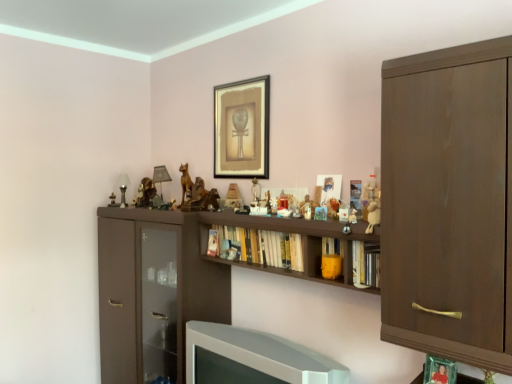
This screenshot has width=512, height=384. What do you see at coordinates (350, 220) in the screenshot?
I see `wooden figurine at center, the 2th toy positioned from the right` at bounding box center [350, 220].

What is the approximate width of hardcover book at center, which ranks as the 3th book in left-to-right order?

hardcover book at center, which ranks as the 3th book in left-to-right order, is 4.78 inches in width.

In order to face white plush sheep at center-right, acting as the first toy starting from the right, should I rotate leftwards or rightwards?

To face it directly, rotate right by 15.589 degrees.

Measure the distance between point [371,218] and camera.

They are 5.12 feet apart.

What are the coordinates of `bronze statue at center` in the screenshot? It's located at (185, 180).

What do you see at coordinates (448, 202) in the screenshot? I see `dark brown wood cabinet at right` at bounding box center [448, 202].

This screenshot has width=512, height=384. What are the coordinates of `wooden figurine at center, placed as the 3th toy when sorted from back to front` in the screenshot? It's located at (350, 220).

Can you confirm if matte wooden figurine at center, the 2th toy positioned from the left, is thinner than yellow matte bookshelf at center, acting as the second book starting from the front?

Yes.

How different are the orientations of matte wooden figurine at center, marked as the 2th toy in a back-to-front arrangement, and yellow matte bookshelf at center, marked as the 2th book in a back-to-front arrangement, in degrees?

The facing directions of matte wooden figurine at center, marked as the 2th toy in a back-to-front arrangement, and yellow matte bookshelf at center, marked as the 2th book in a back-to-front arrangement, are 1.01 degrees apart.

Is matte wooden figurine at center, which ranks as the third toy in right-to-left order, inside the boundaries of yellow matte bookshelf at center, which is counted as the 2th book, starting from the left, or outside?

matte wooden figurine at center, which ranks as the third toy in right-to-left order, is located beyond the bounds of yellow matte bookshelf at center, which is counted as the 2th book, starting from the left.

Which is behind, point (309, 209) or point (322, 259)?

The point (309, 209) is farther.

Is white glossy television at lower center oriented towards wooden figurine at center, the 2th toy positioned from the right?

No, white glossy television at lower center is not facing towards wooden figurine at center, the 2th toy positioned from the right.

Do you think white glossy television at lower center is within wooden figurine at center, which is the second toy in front-to-back order, or outside of it?

white glossy television at lower center exists outside the volume of wooden figurine at center, which is the second toy in front-to-back order.

Who is more distant, white glossy television at lower center or wooden figurine at center, placed as the 3th toy when sorted from back to front?

wooden figurine at center, placed as the 3th toy when sorted from back to front, is more distant.

Measure the distance between white glossy television at lower center and wooden figurine at center, the third toy viewed from the left.

white glossy television at lower center is 24.74 inches away from wooden figurine at center, the third toy viewed from the left.

Based on the photo, is dark brown wood cabinet at right facing away from matte black picture frame at upper center?

No.

Locate an element on the screen. Image resolution: width=512 pixels, height=384 pixels. cabinetry that appears on the right of matte black picture frame at upper center is located at coordinates (448, 202).

Consider the image. Which object is closer to the camera, dark brown wood cabinet at right or matte black picture frame at upper center?

Positioned in front is dark brown wood cabinet at right.

Considering the sizes of dark brown wood cabinet at right and matte black picture frame at upper center in the image, is dark brown wood cabinet at right bigger or smaller than matte black picture frame at upper center?

dark brown wood cabinet at right is bigger than matte black picture frame at upper center.

Is metallic figurine at left, which is counted as the 1th toy, starting from the left, oriented away from matte black picture frame at upper center?

No, metallic figurine at left, which is counted as the 1th toy, starting from the left, is not facing away from matte black picture frame at upper center.

Who is bigger, metallic figurine at left, the fourth toy when ordered from front to back, or matte black picture frame at upper center?

matte black picture frame at upper center.

Are metallic figurine at left, the fourth toy when ordered from front to back, and matte black picture frame at upper center beside each other?

No, metallic figurine at left, the fourth toy when ordered from front to back, is not making contact with matte black picture frame at upper center.

From the picture: Is metallic figurine at left, which is the fourth toy in right-to-left order, outside of matte black picture frame at upper center?

That's correct, metallic figurine at left, which is the fourth toy in right-to-left order, is outside of matte black picture frame at upper center.

Looking at this image, is wooden figurine at center, placed as the 3th toy when sorted from back to front, to the left of matte black picture frame at upper center from the viewer's perspective?

No, wooden figurine at center, placed as the 3th toy when sorted from back to front, is not to the left of matte black picture frame at upper center.

Locate an element on the screen. Image resolution: width=512 pixels, height=384 pixels. picture frame above the wooden figurine at center, placed as the 3th toy when sorted from back to front (from the image's perspective) is located at coordinates (242, 129).

Does wooden figurine at center, placed as the 3th toy when sorted from back to front, turn towards matte black picture frame at upper center?

No, wooden figurine at center, placed as the 3th toy when sorted from back to front, is not aimed at matte black picture frame at upper center.

How distant is wooden figurine at center, placed as the 3th toy when sorted from back to front, from matte black picture frame at upper center?

wooden figurine at center, placed as the 3th toy when sorted from back to front, is 85.20 centimeters away from matte black picture frame at upper center.

Which is correct: white glossy television at lower center is inside metallic figurine at left, which is the first toy from back to front, or outside of it?

white glossy television at lower center exists outside the volume of metallic figurine at left, which is the first toy from back to front.

Is white glossy television at lower center oriented away from metallic figurine at left, which is counted as the 1th toy, starting from the left?

No, white glossy television at lower center is not facing the opposite direction of metallic figurine at left, which is counted as the 1th toy, starting from the left.

Can you confirm if white glossy television at lower center is bigger than metallic figurine at left, which is counted as the 1th toy, starting from the left?

Indeed, white glossy television at lower center has a larger size compared to metallic figurine at left, which is counted as the 1th toy, starting from the left.

From the image's perspective, relative to metallic figurine at left, the fourth toy when ordered from front to back, is white glossy television at lower center above or below?

From the image's perspective, white glossy television at lower center appears below metallic figurine at left, the fourth toy when ordered from front to back.

Based on the photo, from the image's perspective, which is below, yellow matte bookshelf at center, acting as the second book starting from the front, or metallic figurine at left, which is the fourth toy in right-to-left order?

From the image's view, yellow matte bookshelf at center, acting as the second book starting from the front, is below.

How different are the orientations of yellow matte bookshelf at center, marked as the 2th book in a back-to-front arrangement, and metallic figurine at left, which is counted as the 1th toy, starting from the left, in degrees?

2.99 degrees separate the facing orientations of yellow matte bookshelf at center, marked as the 2th book in a back-to-front arrangement, and metallic figurine at left, which is counted as the 1th toy, starting from the left.

How much distance is there between yellow matte bookshelf at center, marked as the 2th book in a back-to-front arrangement, and metallic figurine at left, which is the fourth toy in right-to-left order?

yellow matte bookshelf at center, marked as the 2th book in a back-to-front arrangement, is 4.47 feet from metallic figurine at left, which is the fourth toy in right-to-left order.

From a real-world perspective, is yellow matte bookshelf at center, acting as the second book starting from the front, positioned above or below metallic figurine at left, the fourth toy when ordered from front to back?

From a real-world perspective, yellow matte bookshelf at center, acting as the second book starting from the front, is physically below metallic figurine at left, the fourth toy when ordered from front to back.

Identify the location of the 1st book to the right when counting from the matte wooden figurine at center, the third toy when ordered from front to back. This screenshot has height=384, width=512. (331, 258).

This screenshot has width=512, height=384. In order to click on television lying in front of the wooden figurine at center, placed as the 3th toy when sorted from back to front in this screenshot , I will do `click(259, 356)`.

Considering their positions, is bronze statue at center positioned closer to white glossy television at lower center than matte black picture frame at upper center?

Based on the image, bronze statue at center appears to be nearer to white glossy television at lower center.

Looking at the image, which one is located closer to wooden figurine at center, which is the second toy in front-to-back order, white glossy television at lower center or matte wooden figurine at center, marked as the 2th toy in a back-to-front arrangement?

Among the two, matte wooden figurine at center, marked as the 2th toy in a back-to-front arrangement, is located nearer to wooden figurine at center, which is the second toy in front-to-back order.

Based on their spatial positions, is matte wooden figurine at center, which ranks as the third toy in right-to-left order, or yellow matte bookshelf at center, acting as the second book starting from the front, closer to dark brown wood cabinet at right?

Based on the image, yellow matte bookshelf at center, acting as the second book starting from the front, appears to be nearer to dark brown wood cabinet at right.

Which object lies further to the anchor point bronze statue at center, hardcover book at center, which is counted as the first book, starting from the front, or white glossy television at lower center?

hardcover book at center, which is counted as the first book, starting from the front.

Looking at the image, which one is located further to bronze statue at center, wooden figurine at center, placed as the 3th toy when sorted from back to front, or matte wooden figurine at center, the third toy when ordered from front to back?

wooden figurine at center, placed as the 3th toy when sorted from back to front.

Considering their positions, is matte black picture frame at upper center positioned further to hardcover books at center, the 3th book positioned from the right, than matte wooden figurine at center, which ranks as the third toy in right-to-left order?

The object further to hardcover books at center, the 3th book positioned from the right, is matte black picture frame at upper center.

Considering their positions, is matte black picture frame at upper center positioned further to wooden figurine at center, the third toy viewed from the left, than dark brown wood cabinet at right?

matte black picture frame at upper center.

Which object lies nearer to the anchor point matte black picture frame at upper center, wooden figurine at center, placed as the 3th toy when sorted from back to front, or hardcover book at center, which is counted as the first book, starting from the front?

Among the two, wooden figurine at center, placed as the 3th toy when sorted from back to front, is located nearer to matte black picture frame at upper center.

Where is `book between hardcover books at center, the first book positioned from the back, and wooden figurine at center, placed as the 3th toy when sorted from back to front, in the horizontal direction`? book between hardcover books at center, the first book positioned from the back, and wooden figurine at center, placed as the 3th toy when sorted from back to front, in the horizontal direction is located at coordinates (331, 258).

Find the location of a particular element. This screenshot has height=384, width=512. television positioned between dark brown wood cabinet at right and bronze statue at center from near to far is located at coordinates (259, 356).

I want to click on toy between wooden figurine at center, placed as the 3th toy when sorted from back to front, and bronze statue at center from front to back, so click(307, 208).

Where is `animal situated between metallic figurine at left, which is the first toy from back to front, and yellow matte bookshelf at center, acting as the second book starting from the front, from left to right`? The image size is (512, 384). animal situated between metallic figurine at left, which is the first toy from back to front, and yellow matte bookshelf at center, acting as the second book starting from the front, from left to right is located at coordinates (185, 180).